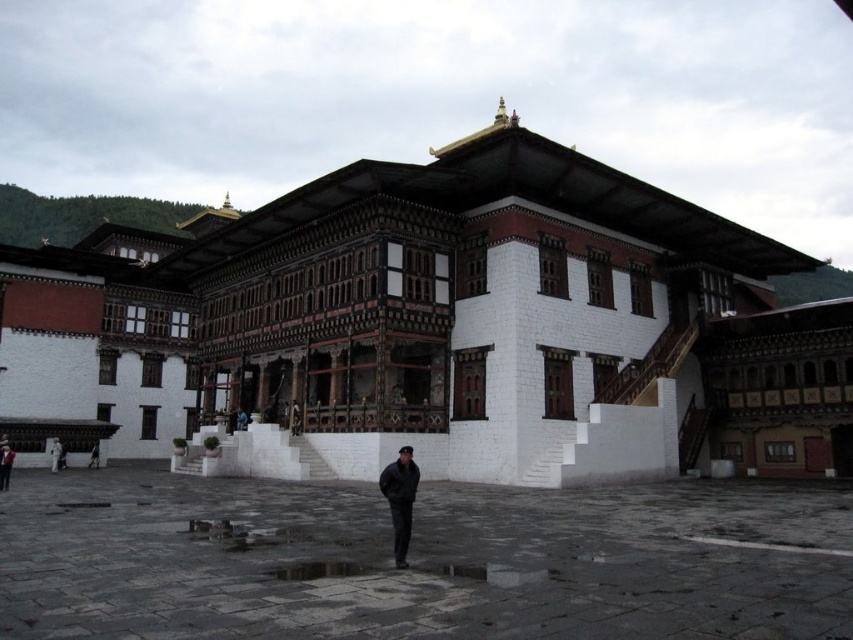
You are a visitor at this Bhutanese architectural site and notice two items in the scene. One is a black matte jacket at center and the other is a dark gray fabric at lower left. Which of these two items is bigger in size?

The black matte jacket at center has a larger size compared to the dark gray fabric at lower left.

You are standing at the base of the traditional Bhutanese structure and want to reach the point marked at coordinate point (584, 592). Given that the structure has wide stone steps leading to its elevated central section, do you need to climb the steps to reach this point?

Yes, you need to climb the steps because the central section of the structure is elevated slightly above ground level, and the point marked at coordinate point (584, 592) is part of the elevated area accessible via the wide stone steps.

You are standing in front of the traditional Bhutanese architectural structure and notice a black matte jacket at center. Based on its coordinates, is the jacket closer to the central section or one of the flanking wings?

The black matte jacket at center is located at point coordinates that place it in the central section of the building, so it is closer to the central section.